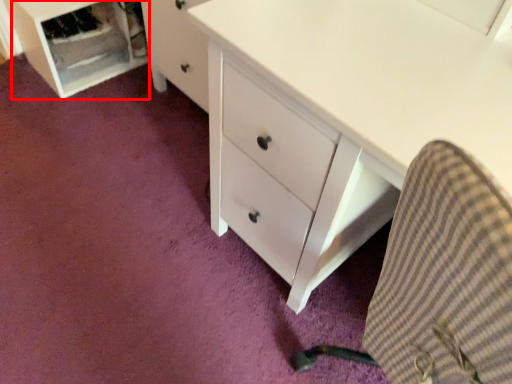
Question: Considering the relative positions of file cabinet (annotated by the red box) and computer chair in the image provided, where is file cabinet (annotated by the red box) located with respect to the staircase?

Choices:
 (A) right
 (B) left

Answer: (B)